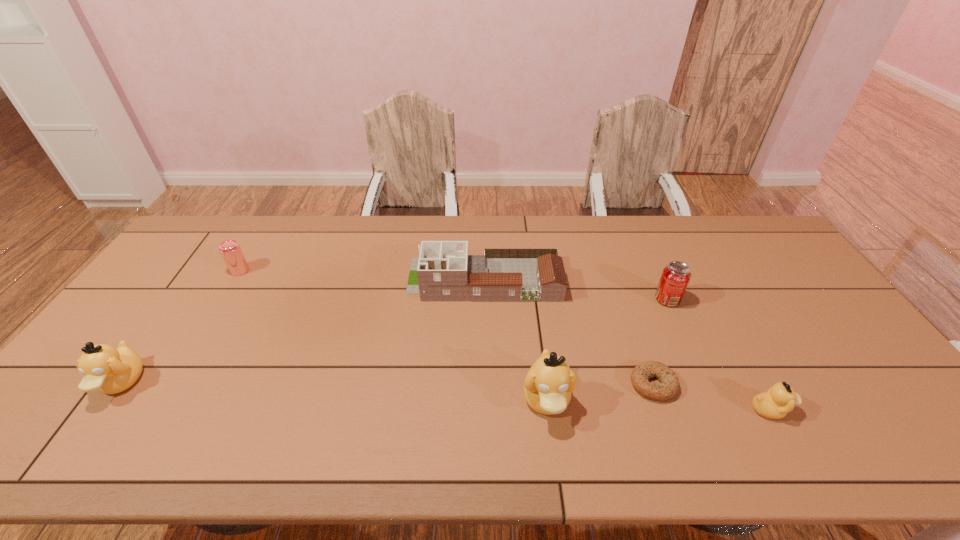
The width and height of the screenshot is (960, 540). I want to click on free spot between the dollhouse and the rightmost duckling, so click(x=628, y=345).

Identify the location of empty space between the dollhouse and the shortest duckling. (628, 345).

The image size is (960, 540). Identify the location of unoccupied position between the bagel and the second object from left to right. (446, 327).

You are a GUI agent. You are given a task and a screenshot of the screen. Output one action in this format:
    pyautogui.click(x=<x>, y=<y>)
    Task: Click on the vacant space that's between the second object from left to right and the rightmost object
    
    Given the screenshot: What is the action you would take?
    pyautogui.click(x=505, y=340)

Identify the location of empty space that is in between the second duckling from right to left and the beer can. (394, 335).

What are the coordinates of `the sixth closest object relative to the sixth object from right to left` in the screenshot? It's located at (780, 399).

Point out which object is positioned as the nearest to the beer can. Please provide its 2D coordinates. Your answer should be formatted as a tuple, i.e. [(x, y)], where the tuple contains the x and y coordinates of a point satisfying the conditions above.

[(109, 370)]

Identify which duckling is the second nearest to the beer can. Please provide its 2D coordinates. Your answer should be formatted as a tuple, i.e. [(x, y)], where the tuple contains the x and y coordinates of a point satisfying the conditions above.

[(548, 384)]

Locate which duckling is the closest to the soda can. Please provide its 2D coordinates. Your answer should be formatted as a tuple, i.e. [(x, y)], where the tuple contains the x and y coordinates of a point satisfying the conditions above.

[(780, 399)]

Locate an element on the screen. This screenshot has width=960, height=540. vacant space that satisfies the following two spatial constraints: 1. at the main entrance of the dollhouse; 2. on the left side of the fourth shortest object is located at coordinates (485, 299).